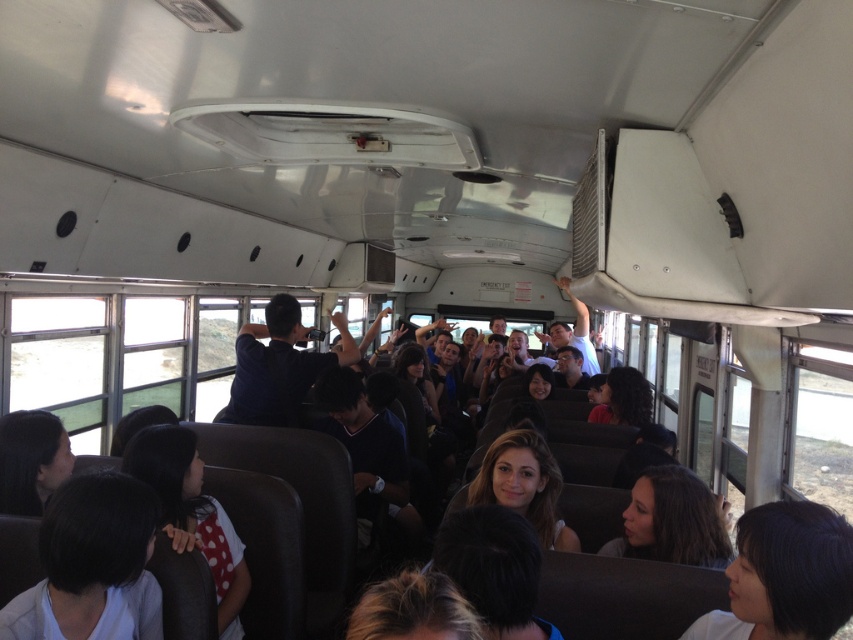
Question: Which point appears farthest from the camera in this image?

Choices:
 (A) (785, 573)
 (B) (9, 604)
 (C) (660, 481)

Answer: (C)

Question: Does dark hair at lower right have a greater width compared to dark brown hair at center?

Choices:
 (A) no
 (B) yes

Answer: (A)

Question: Is dark hair at lower right to the left of dark brown hair at center from the viewer's perspective?

Choices:
 (A) no
 (B) yes

Answer: (B)

Question: Which point is closer to the camera taking this photo?

Choices:
 (A) (24, 592)
 (B) (654, 492)

Answer: (A)

Question: Is dark hair at lower right to the left of dark brown hair at center from the viewer's perspective?

Choices:
 (A) no
 (B) yes

Answer: (B)

Question: Among these objects, which one is nearest to the camera?

Choices:
 (A) dark hair at lower right
 (B) dark brown hair at center

Answer: (A)